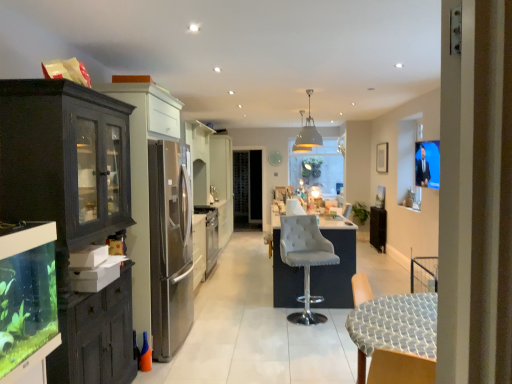
Question: Can you see wooden chair at lower right, which appears as the 1th chair when viewed from the front, touching suede-like white bar stool at center, acting as the second chair starting from the front?

Choices:
 (A) no
 (B) yes

Answer: (A)

Question: Is wooden chair at lower right, which appears as the 1th chair when viewed from the front, closer to camera compared to suede-like white bar stool at center, marked as the first chair in a back-to-front arrangement?

Choices:
 (A) no
 (B) yes

Answer: (B)

Question: Is wooden chair at lower right, arranged as the second chair when viewed from the back, not inside suede-like white bar stool at center, acting as the second chair starting from the front?

Choices:
 (A) no
 (B) yes

Answer: (B)

Question: Considering the relative positions of wooden chair at lower right, which appears as the 1th chair when viewed from the front, and suede-like white bar stool at center, acting as the second chair starting from the front, in the image provided, is wooden chair at lower right, which appears as the 1th chair when viewed from the front, to the right of suede-like white bar stool at center, acting as the second chair starting from the front, from the viewer's perspective?

Choices:
 (A) yes
 (B) no

Answer: (A)

Question: From a real-world perspective, is wooden chair at lower right, which appears as the 1th chair when viewed from the front, under suede-like white bar stool at center, acting as the second chair starting from the front?

Choices:
 (A) no
 (B) yes

Answer: (B)

Question: From the image's perspective, is clear glass aquarium at left positioned above or below matte white pendant light at upper center, arranged as the first lamp when viewed from the front?

Choices:
 (A) below
 (B) above

Answer: (A)

Question: Visually, is clear glass aquarium at left positioned to the left or to the right of matte white pendant light at upper center, arranged as the first lamp when viewed from the front?

Choices:
 (A) right
 (B) left

Answer: (B)

Question: Is clear glass aquarium at left wider or thinner than matte white pendant light at upper center, which is the second lamp from back to front?

Choices:
 (A) wide
 (B) thin

Answer: (B)

Question: Based on their sizes in the image, would you say clear glass aquarium at left is bigger or smaller than matte white pendant light at upper center, which is the second lamp from back to front?

Choices:
 (A) small
 (B) big

Answer: (B)

Question: Looking at the image, does suede-like white bar stool at center, marked as the first chair in a back-to-front arrangement, seem bigger or smaller compared to metallic gray pendant light at upper center, positioned as the first lamp in back-to-front order?

Choices:
 (A) big
 (B) small

Answer: (A)

Question: From the image's perspective, relative to metallic gray pendant light at upper center, positioned as the first lamp in back-to-front order, is suede-like white bar stool at center, marked as the first chair in a back-to-front arrangement, above or below?

Choices:
 (A) above
 (B) below

Answer: (B)

Question: Considering the positions of point (294, 218) and point (302, 112), is point (294, 218) closer or farther from the camera than point (302, 112)?

Choices:
 (A) closer
 (B) farther

Answer: (A)

Question: From a real-world perspective, is suede-like white bar stool at center, acting as the second chair starting from the front, physically located above or below metallic gray pendant light at upper center, positioned as the first lamp in back-to-front order?

Choices:
 (A) below
 (B) above

Answer: (A)

Question: Is metallic gray pendant light at upper center, positioned as the first lamp in back-to-front order, spatially inside satin silver oven at center, or outside of it?

Choices:
 (A) inside
 (B) outside

Answer: (B)

Question: Looking at the image, does metallic gray pendant light at upper center, positioned as the first lamp in back-to-front order, seem bigger or smaller compared to satin silver oven at center?

Choices:
 (A) big
 (B) small

Answer: (B)